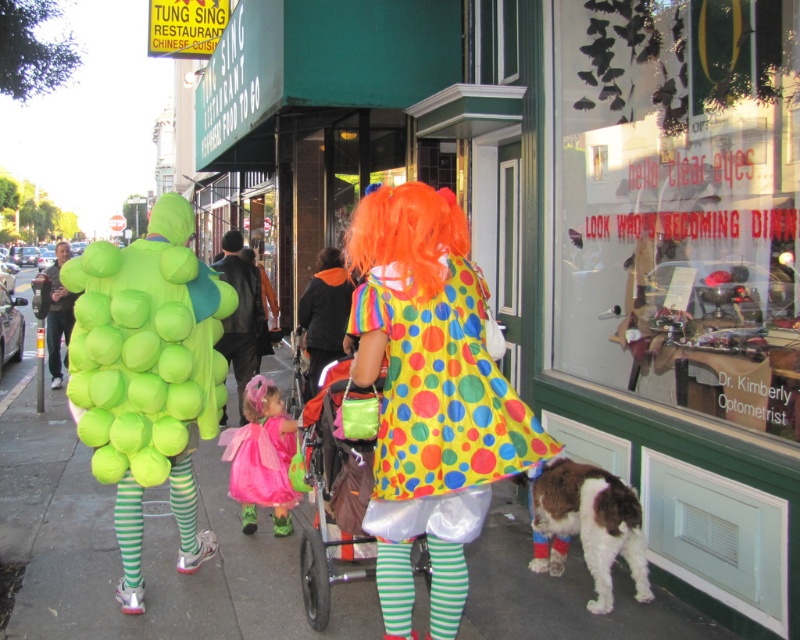
Question: Which object is the closest to the white fluffy dog at lower right?

Choices:
 (A) orange synthetic wig at center
 (B) polyester fabric stroller at center

Answer: (B)

Question: Which object is farther from the camera taking this photo?

Choices:
 (A) smooth asphalt sidewalk at center
 (B) pink satin dress at center
 (C) polka dot fabric clown dress at center
 (D) rainbow polka dot dress at center

Answer: (D)

Question: Does clear glass window at upper right have a smaller size compared to orange synthetic wig at center?

Choices:
 (A) no
 (B) yes

Answer: (A)

Question: Among these points, which one is nearest to the camera?

Choices:
 (A) tap(633, 538)
 (B) tap(378, 253)
 (C) tap(280, 492)
 (D) tap(425, 563)

Answer: (B)

Question: Does clear glass window at upper right appear under smooth asphalt sidewalk at center?

Choices:
 (A) no
 (B) yes

Answer: (A)

Question: Does white fluffy dog at lower right appear over rainbow polka dot dress at center?

Choices:
 (A) no
 (B) yes

Answer: (A)